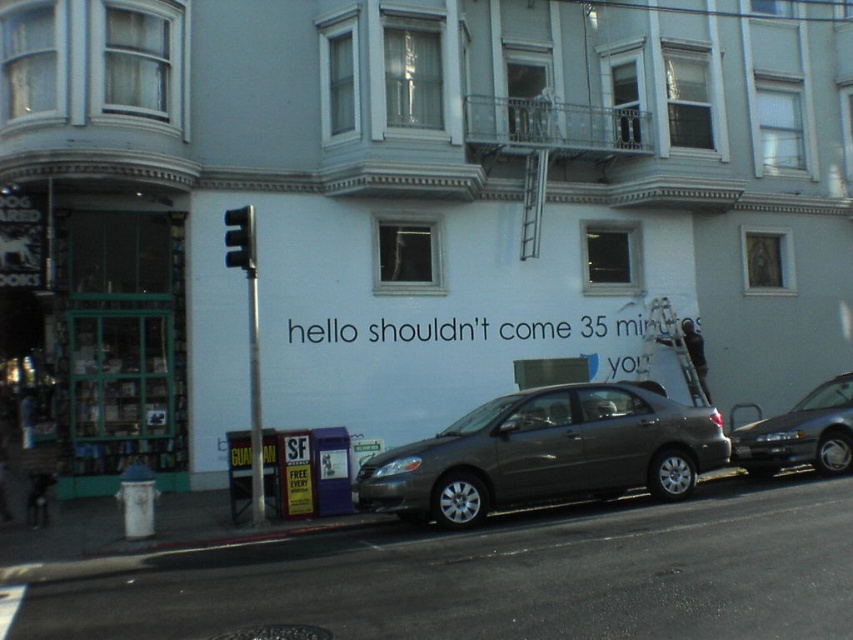
Question: Does metallic gray sedan at center appear under black plastic traffic light at upper left?

Choices:
 (A) no
 (B) yes

Answer: (B)

Question: Which of the following is the farthest from the observer?

Choices:
 (A) black plastic traffic light at upper left
 (B) metallic gray sedan at center
 (C) satin gray sedan at center

Answer: (B)

Question: Does satin gray sedan at center come behind metallic gray sedan at center?

Choices:
 (A) yes
 (B) no

Answer: (B)

Question: Based on their relative distances, which object is farther from the metallic gray sedan at center?

Choices:
 (A) satin gray sedan at center
 (B) black plastic traffic light at upper left

Answer: (B)

Question: Among these points, which one is nearest to the camera?

Choices:
 (A) (242, 266)
 (B) (843, 464)
 (C) (508, 422)

Answer: (C)

Question: Is satin gray sedan at center in front of metallic gray sedan at center?

Choices:
 (A) no
 (B) yes

Answer: (B)